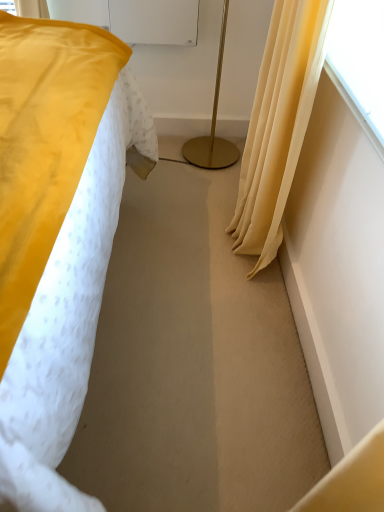
Question: Can you confirm if matte yellow curtain at right is positioned to the left of transparent plastic screen at upper right?

Choices:
 (A) yes
 (B) no

Answer: (A)

Question: From a real-world perspective, is matte yellow curtain at right located higher than transparent plastic screen at upper right?

Choices:
 (A) yes
 (B) no

Answer: (B)

Question: From a real-world perspective, is matte yellow curtain at right positioned under transparent plastic screen at upper right based on gravity?

Choices:
 (A) yes
 (B) no

Answer: (A)

Question: From the image's perspective, is matte yellow curtain at right over transparent plastic screen at upper right?

Choices:
 (A) no
 (B) yes

Answer: (A)

Question: Is matte yellow curtain at right to the right of transparent plastic screen at upper right from the viewer's perspective?

Choices:
 (A) no
 (B) yes

Answer: (A)

Question: From the image's perspective, is gold metallic floor lamp at center located above or below transparent plastic screen at upper right?

Choices:
 (A) above
 (B) below

Answer: (A)

Question: Would you say gold metallic floor lamp at center is inside or outside transparent plastic screen at upper right?

Choices:
 (A) inside
 (B) outside

Answer: (B)

Question: From a real-world perspective, relative to transparent plastic screen at upper right, is gold metallic floor lamp at center vertically above or below?

Choices:
 (A) above
 (B) below

Answer: (B)

Question: Is gold metallic floor lamp at center taller or shorter than transparent plastic screen at upper right?

Choices:
 (A) short
 (B) tall

Answer: (B)

Question: From a real-world perspective, relative to gold metallic floor lamp at center, is transparent plastic screen at upper right vertically above or below?

Choices:
 (A) below
 (B) above

Answer: (B)

Question: Based on their positions, is transparent plastic screen at upper right located to the left or right of gold metallic floor lamp at center?

Choices:
 (A) right
 (B) left

Answer: (A)

Question: Is transparent plastic screen at upper right situated inside gold metallic floor lamp at center or outside?

Choices:
 (A) inside
 (B) outside

Answer: (B)

Question: Is point (365, 42) closer or farther from the camera than point (223, 18)?

Choices:
 (A) closer
 (B) farther

Answer: (A)

Question: Considering the positions of point (382, 113) and point (246, 179), is point (382, 113) closer or farther from the camera than point (246, 179)?

Choices:
 (A) farther
 (B) closer

Answer: (B)

Question: Is transparent plastic screen at upper right inside the boundaries of matte yellow curtain at right, or outside?

Choices:
 (A) inside
 (B) outside

Answer: (B)